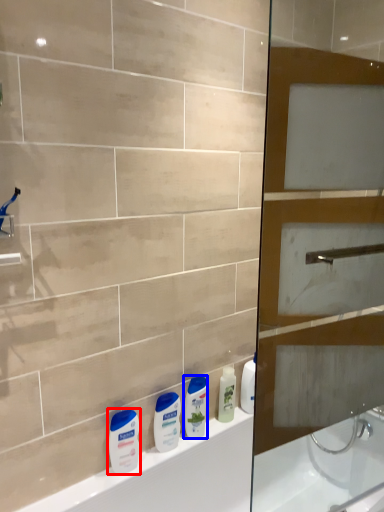
Question: Which object is further to the camera taking this photo, toiletry (highlighted by a red box) or cleaning product (highlighted by a blue box)?

Choices:
 (A) toiletry
 (B) cleaning product

Answer: (B)